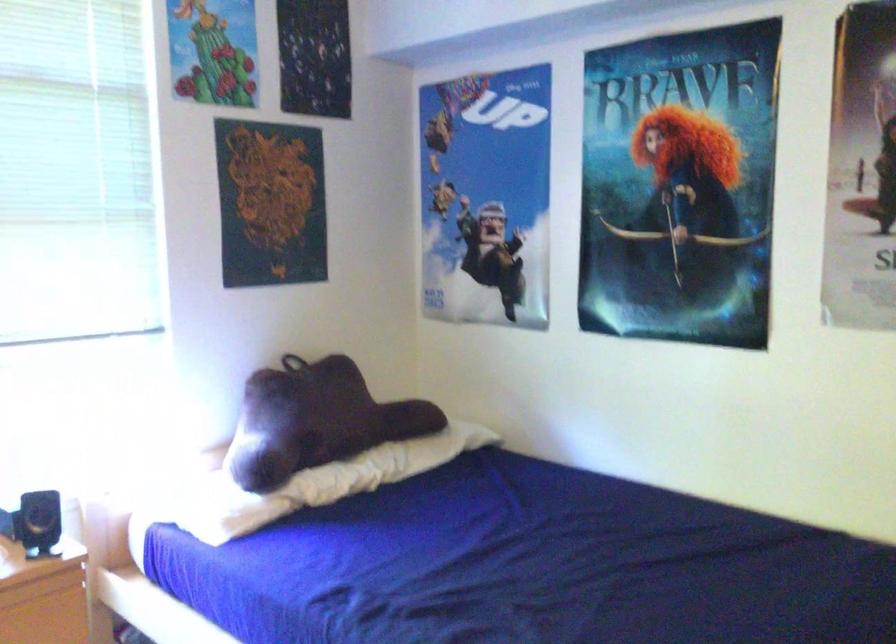
The height and width of the screenshot is (644, 896). Find the location of `black speaker`. black speaker is located at coordinates (39, 523).